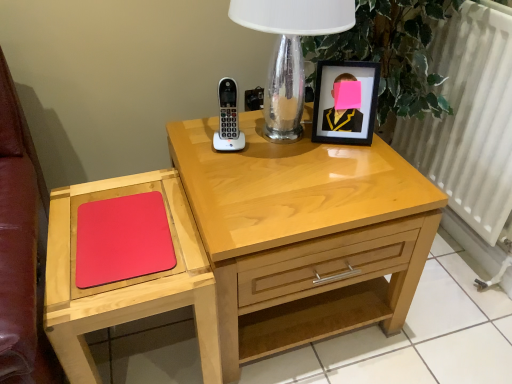
Question: Does light wood nightstand at center have a greater width compared to white plastic phone at center?

Choices:
 (A) yes
 (B) no

Answer: (A)

Question: Is light wood nightstand at center looking in the opposite direction of white plastic phone at center?

Choices:
 (A) yes
 (B) no

Answer: (B)

Question: Is light wood nightstand at center outside of white plastic phone at center?

Choices:
 (A) no
 (B) yes

Answer: (B)

Question: From a real-world perspective, is light wood nightstand at center on top of white plastic phone at center?

Choices:
 (A) no
 (B) yes

Answer: (A)

Question: Could you tell me if light wood nightstand at center is facing white plastic phone at center?

Choices:
 (A) no
 (B) yes

Answer: (A)

Question: Does light wood nightstand at center have a smaller size compared to white plastic phone at center?

Choices:
 (A) no
 (B) yes

Answer: (A)

Question: From the image's perspective, is matte wood mouse pad at left on top of white metallic radiator at right?

Choices:
 (A) no
 (B) yes

Answer: (A)

Question: Considering the relative sizes of matte wood mouse pad at left and white metallic radiator at right in the image provided, is matte wood mouse pad at left thinner than white metallic radiator at right?

Choices:
 (A) no
 (B) yes

Answer: (A)

Question: Is matte wood mouse pad at left not near white metallic radiator at right?

Choices:
 (A) yes
 (B) no

Answer: (A)

Question: Is matte wood mouse pad at left smaller than white metallic radiator at right?

Choices:
 (A) yes
 (B) no

Answer: (A)

Question: Considering the relative sizes of matte wood mouse pad at left and white metallic radiator at right in the image provided, is matte wood mouse pad at left bigger than white metallic radiator at right?

Choices:
 (A) no
 (B) yes

Answer: (A)

Question: Does matte wood mouse pad at left come behind white metallic radiator at right?

Choices:
 (A) no
 (B) yes

Answer: (A)

Question: Does matte wood mouse pad at left have a lesser width compared to white plastic phone at center?

Choices:
 (A) yes
 (B) no

Answer: (B)